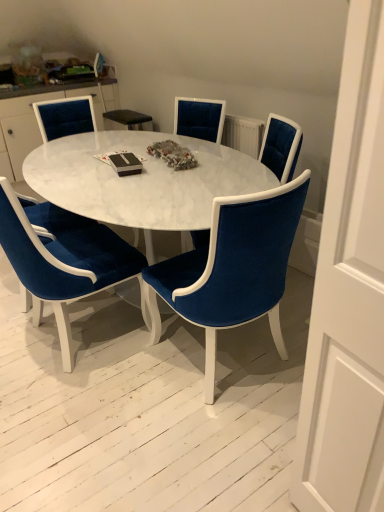
Question: In the image, is velvet blue chair at center, the first chair positioned from the right, positioned in front of or behind white marble coffee table at center?

Choices:
 (A) front
 (B) behind

Answer: (B)

Question: Based on their positions, is velvet blue chair at center, the first chair positioned from the right, located to the left or right of white marble coffee table at center?

Choices:
 (A) left
 (B) right

Answer: (B)

Question: Which object is positioned farthest from the white marble coffee table at center?

Choices:
 (A) velvet blue chair at center, which is the fourth chair in left-to-right order
 (B) velvet blue chair at upper left, which is counted as the 5th chair, starting from the right
 (C) velvet blue chair at center, which ranks as the third chair in right-to-left order
 (D) velvet blue chair at center, which is counted as the 5th chair, starting from the left
 (E) velvet blue armchair at lower left

Answer: (B)

Question: Which of these objects is positioned closest to the velvet blue chair at center, which is the fourth chair in left-to-right order?

Choices:
 (A) velvet blue chair at center, which appears as the 2th chair when viewed from the left
 (B) velvet blue chair at upper left, which is counted as the 5th chair, starting from the right
 (C) white marble coffee table at center
 (D) velvet blue armchair at lower left
 (E) velvet blue chair at center, which ranks as the third chair in right-to-left order

Answer: (C)